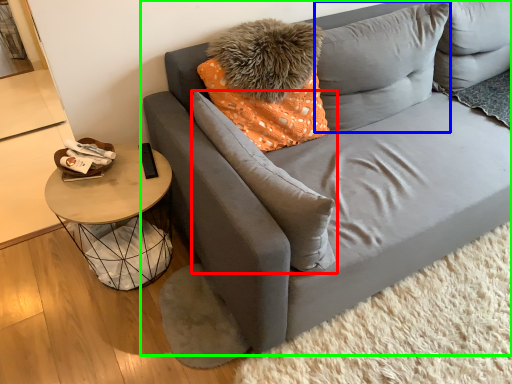
Question: Which object is the farthest from pillow (highlighted by a red box)? Choose among these: pillow (highlighted by a blue box) or studio couch (highlighted by a green box).

Choices:
 (A) pillow
 (B) studio couch

Answer: (A)